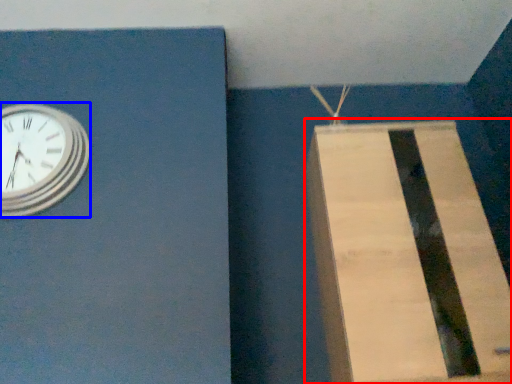
Question: Which object is closer to the camera taking this photo, cardboard box (highlighted by a red box) or wall clock (highlighted by a blue box)?

Choices:
 (A) cardboard box
 (B) wall clock

Answer: (A)